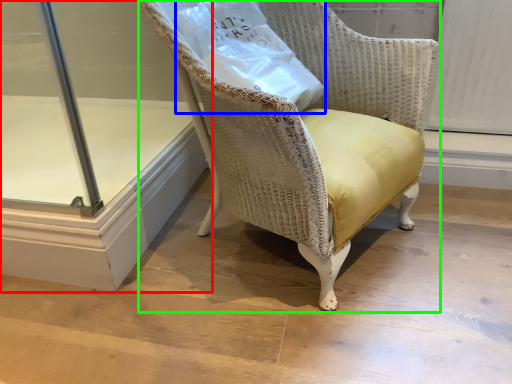
Question: Based on their relative distances, which object is nearer to glass door (highlighted by a red box)? Choose from paper bag (highlighted by a blue box) and chair (highlighted by a green box).

Choices:
 (A) paper bag
 (B) chair

Answer: (B)